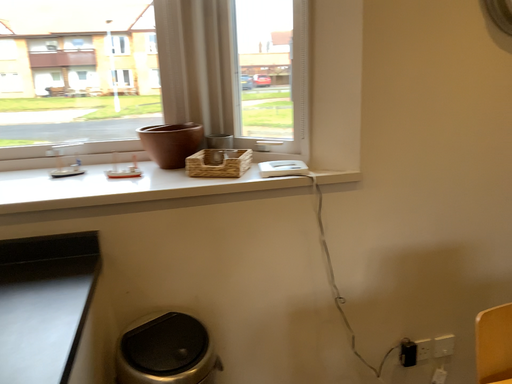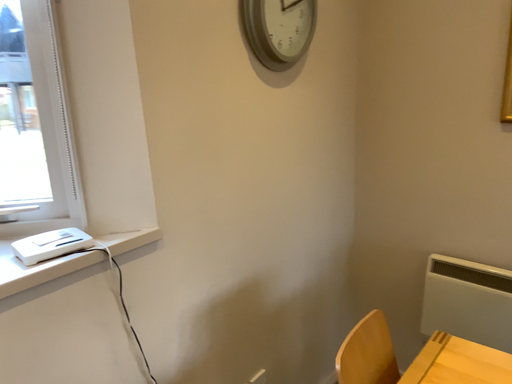
Question: Which way did the camera rotate in the video?

Choices:
 (A) rotated downward
 (B) rotated upward

Answer: (B)